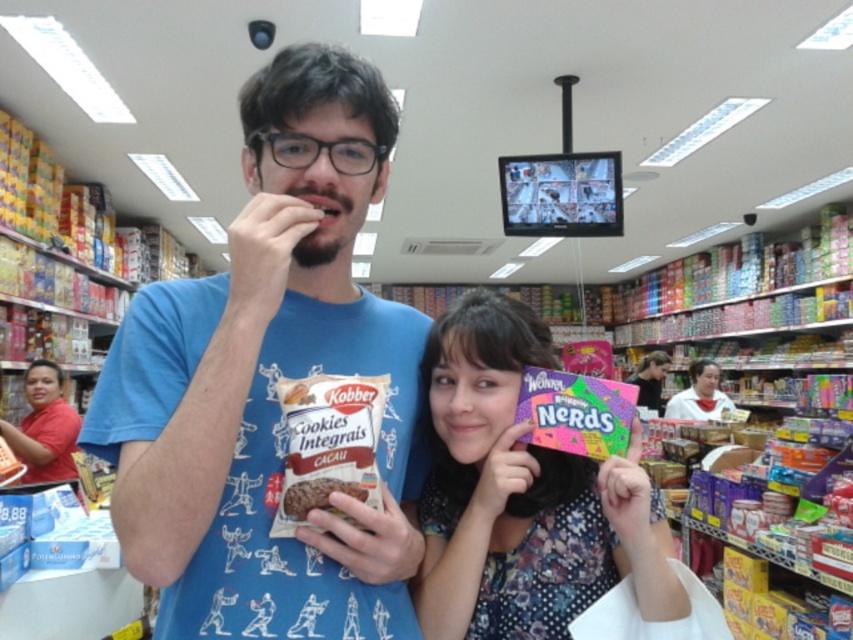
Question: Can you confirm if multicolored paper candy at center is positioned below matte white shirt at center?

Choices:
 (A) no
 (B) yes

Answer: (A)

Question: Which point is closer to the camera taking this photo?

Choices:
 (A) click(x=229, y=548)
 (B) click(x=509, y=353)
 (C) click(x=711, y=419)
 (D) click(x=322, y=483)

Answer: (D)

Question: Considering the real-world distances, which object is closest to the brown matte cookies at center?

Choices:
 (A) multicolored paper candy at center
 (B) matte pink candy at center
 (C) matte white shirt at center

Answer: (A)

Question: Is brown matte cookies at center behind matte pink candy at center?

Choices:
 (A) yes
 (B) no

Answer: (B)

Question: Which object appears closest to the camera in this image?

Choices:
 (A) red shirt at lower left
 (B) matte pink candy at center
 (C) blue cotton shirt at center

Answer: (C)

Question: Is multicolored paper candy at center to the left of brown matte cookies at center from the viewer's perspective?

Choices:
 (A) no
 (B) yes

Answer: (A)